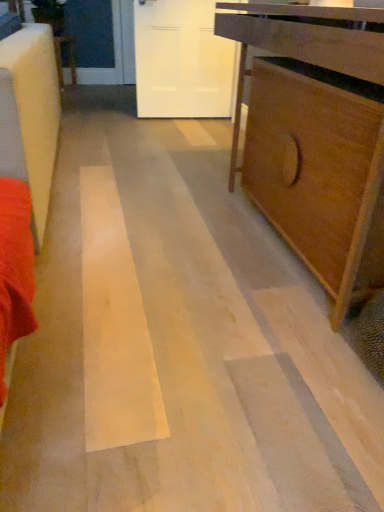
Locate an element on the screen. free space to the left of matte brown cabinet at right is located at coordinates (155, 230).